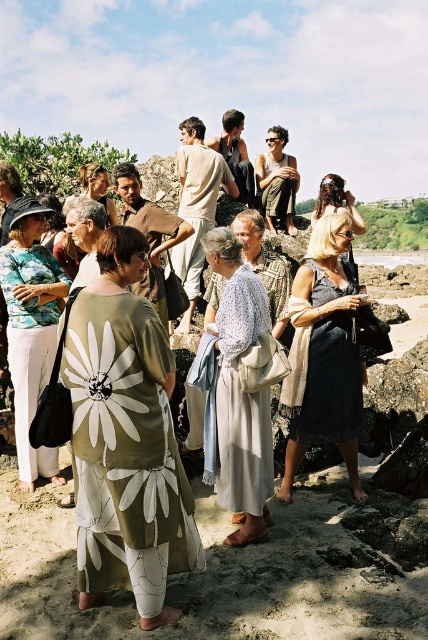
You are a photographer trying to capture the light beige cotton robe at center in your shot. The camera is positioned at the origin point. Which direction should you move the camera to focus on the robe?

The light beige cotton robe at center is located at coordinates point 0.323 on the x axis and 0.463 on the y axis. To focus on the robe, move the camera to the right along the x axis and upwards along the y axis since the robe is positioned to the right and above the origin point.

You are a photographer planning to take a group photo of the people in the scene. The light beige cotton robe at center and the matte brown robe at center are both in the frame. Which robe should you position closer to the camera to ensure it appears larger in the photo?

The light beige cotton robe at center should be positioned closer to the camera because it might be wider than the matte brown robe at center, making it appear larger in the photo.